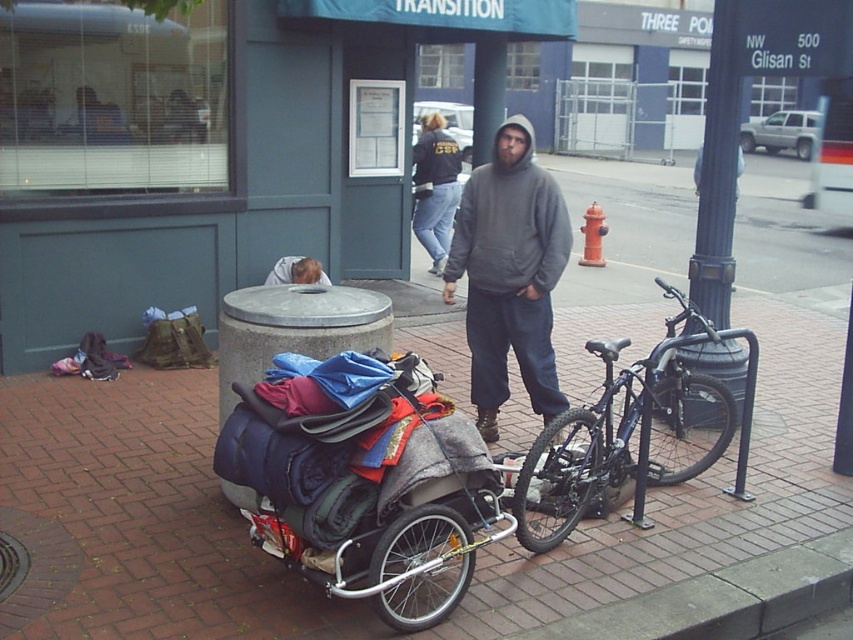
Does brick at lower right appear on the right side of blue fabric sleeping bag at lower left?

Correct, you'll find brick at lower right to the right of blue fabric sleeping bag at lower left.

Which is in front, point (715, 609) or point (318, 266)?

Positioned in front is point (715, 609).

Between point (824, 541) and point (279, 284), which one is positioned in front?

Point (824, 541) is more forward.

You are a GUI agent. You are given a task and a screenshot of the screen. Output one action in this format:
    pyautogui.click(x=<x>, y=<y>)
    Task: Click on the brick at lower right
    The image size is (853, 640).
    Given the screenshot: What is the action you would take?
    pyautogui.click(x=724, y=598)

Is shiny blue bike at center to the right of brick at lower right from the viewer's perspective?

No, shiny blue bike at center is not to the right of brick at lower right.

Who is positioned more to the left, shiny blue bike at center or brick at lower right?

shiny blue bike at center is more to the left.

The height and width of the screenshot is (640, 853). In order to click on shiny blue bike at center in this screenshot , I will do `click(624, 432)`.

I want to click on shiny blue bike at center, so click(x=624, y=432).

This screenshot has height=640, width=853. What do you see at coordinates (724, 598) in the screenshot? I see `brick at lower right` at bounding box center [724, 598].

Does brick at lower right have a smaller size compared to black metal pole at right?

Yes, brick at lower right is smaller than black metal pole at right.

Which is in front, point (744, 579) or point (712, 346)?

Positioned in front is point (744, 579).

At what (x,y) coordinates should I click in order to perform the action: click on brick at lower right. Please return your answer as a coordinate pair (x, y). The height and width of the screenshot is (640, 853). Looking at the image, I should click on (724, 598).